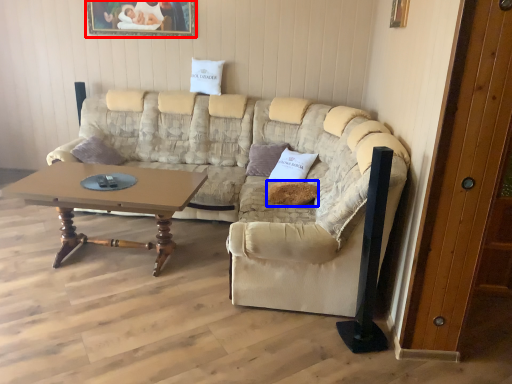
Question: Which point is closer to the camera, picture frame (highlighted by a red box) or pillow (highlighted by a blue box)?

Choices:
 (A) picture frame
 (B) pillow

Answer: (B)